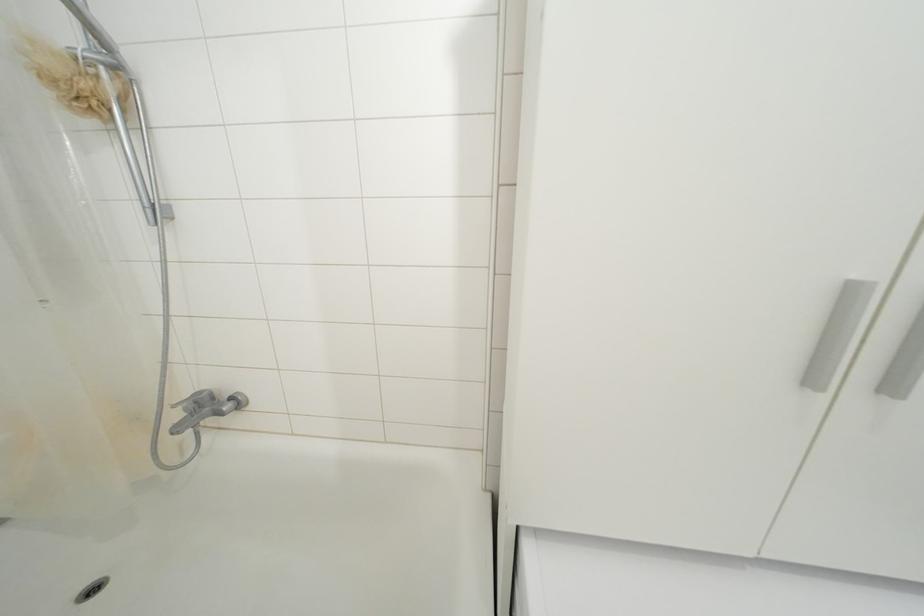
Find where to lift the beige shower loofah. Please return your answer as a coordinate pair (x, y).

(71, 79)